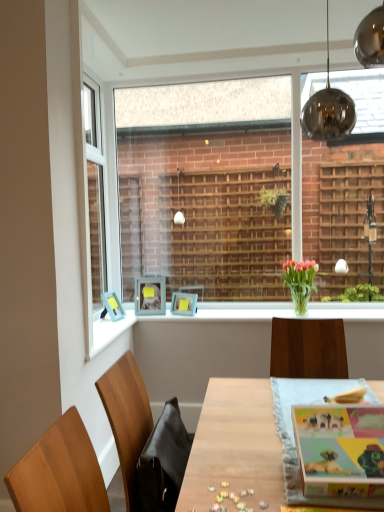
What do you see at coordinates (230, 311) in the screenshot? The width and height of the screenshot is (384, 512). I see `white glossy window sill at center` at bounding box center [230, 311].

Describe the element at coordinates (163, 461) in the screenshot. I see `black leather swivel chair at lower left` at that location.

The image size is (384, 512). In order to click on light blue plastic picture frame at upper left, the second picture frame when ordered from right to left in this screenshot , I will do 150,295.

Image resolution: width=384 pixels, height=512 pixels. Describe the element at coordinates (112, 306) in the screenshot. I see `matte blue picture frame at center, arranged as the 1th picture frame when viewed from the left` at that location.

At what (x,y) coordinates should I click in order to perform the action: click on translucent glass vase at center. Please return your answer as a coordinate pair (x, y). Image resolution: width=384 pixels, height=512 pixels. Looking at the image, I should click on (300, 282).

In terms of height, does clear glass window at center look taller or shorter compared to matte blue picture frame at center, acting as the 3th picture frame starting from the right?

Clearly, clear glass window at center is taller compared to matte blue picture frame at center, acting as the 3th picture frame starting from the right.

Which object is further away from the camera, clear glass window at center or matte blue picture frame at center, acting as the 3th picture frame starting from the right?

clear glass window at center.

Who is smaller, clear glass window at center or matte blue picture frame at center, arranged as the 1th picture frame when viewed from the left?

matte blue picture frame at center, arranged as the 1th picture frame when viewed from the left.

You are a GUI agent. You are given a task and a screenshot of the screen. Output one action in this format:
    pyautogui.click(x=<x>, y=<y>)
    Task: Click on the swivel chair behind the wooden table at center
    
    Given the screenshot: What is the action you would take?
    pyautogui.click(x=163, y=461)

How many degrees apart are the facing directions of wooden table at center and black leather swivel chair at lower left?

The angular difference between wooden table at center and black leather swivel chair at lower left is 90.7 degrees.

From the image's perspective, is wooden table at center located above or below black leather swivel chair at lower left?

wooden table at center is below black leather swivel chair at lower left.

Consider the image. Looking at their sizes, would you say wooden table at center is wider or thinner than black leather swivel chair at lower left?

wooden table at center is wider than black leather swivel chair at lower left.

Does wooden table at center come behind matte blue picture frame at center, arranged as the 1th picture frame when viewed from the left?

No.

Between wooden table at center and matte blue picture frame at center, acting as the 3th picture frame starting from the right, which one has larger width?

With larger width is wooden table at center.

From the wooden table at center, count the 3rd picture frame to the left and point to it. Please provide its 2D coordinates.

[(112, 306)]

Which object is wider, matte blue picture frame at center, acting as the 3th picture frame starting from the right, or wooden table at center?

wooden table at center.

Is matte blue picture frame at center, acting as the 3th picture frame starting from the right, next to wooden table at center and touching it?

matte blue picture frame at center, acting as the 3th picture frame starting from the right, and wooden table at center are clearly separated.

Based on the photo, what's the angular difference between matte blue picture frame at center, acting as the 3th picture frame starting from the right, and wooden table at center's facing directions?

The angular difference between matte blue picture frame at center, acting as the 3th picture frame starting from the right, and wooden table at center is 73.3 degrees.

Based on the photo, measure the distance from matte blue picture frame at center, acting as the 3th picture frame starting from the right, to wooden table at center.

The distance of matte blue picture frame at center, acting as the 3th picture frame starting from the right, from wooden table at center is 4.79 feet.

Considering the relative sizes of black leather swivel chair at lower left and wooden table at center in the image provided, is black leather swivel chair at lower left shorter than wooden table at center?

Yes.

Considering the relative sizes of black leather swivel chair at lower left and wooden table at center in the image provided, is black leather swivel chair at lower left bigger than wooden table at center?

No.

Does point (178, 410) come in front of point (225, 449)?

That is False.

Can you tell me how much wooden table at center and light blue plastic picture frame at upper left, the second picture frame when ordered from right to left, differ in facing direction?

There is a 11.8-degree angle between the facing directions of wooden table at center and light blue plastic picture frame at upper left, the second picture frame when ordered from right to left.

Between wooden table at center and light blue plastic picture frame at upper left, the second picture frame when ordered from right to left, which one is positioned behind?

light blue plastic picture frame at upper left, the second picture frame when ordered from right to left, is more distant.

Is wooden table at center outside of light blue plastic picture frame at upper left, the 2th picture frame viewed from the left?

Absolutely, wooden table at center is external to light blue plastic picture frame at upper left, the 2th picture frame viewed from the left.

Which of these two, wooden table at center or light blue plastic picture frame at upper left, the second picture frame when ordered from right to left, stands taller?

wooden table at center is taller.

Which object is further away from the camera taking this photo, light blue plastic picture frame at upper left, the second picture frame when ordered from right to left, or black leather swivel chair at lower left?

light blue plastic picture frame at upper left, the second picture frame when ordered from right to left, is more distant.

From a real-world perspective, who is located lower, light blue plastic picture frame at upper left, the second picture frame when ordered from right to left, or black leather swivel chair at lower left?

In real-world perspective, black leather swivel chair at lower left is lower.

Is light blue plastic picture frame at upper left, the second picture frame when ordered from right to left, looking in the opposite direction of black leather swivel chair at lower left?

That's not correct — light blue plastic picture frame at upper left, the second picture frame when ordered from right to left, is not looking away from black leather swivel chair at lower left.

Identify the location of the 2nd picture frame below the clear glass window at center (from the image's perspective). The width and height of the screenshot is (384, 512). (112, 306).

Identify the location of swivel chair behind the wooden table at center. This screenshot has width=384, height=512. (163, 461).

Considering their positions, is multicolored paper magazine at center positioned closer to translucent glass vase at center than matte blue picture frame at center, the 3th picture frame when ordered from left to right?

Among the two, matte blue picture frame at center, the 3th picture frame when ordered from left to right, is located nearer to translucent glass vase at center.

From the image, which object appears to be nearer to translucent glass vase at center, multicolored paper magazine at center or matte blue picture frame at center, arranged as the 1th picture frame when viewed from the left?

multicolored paper magazine at center.

Looking at this image, when comparing their distances from wooden table at center, does translucent glass vase at center or light blue plastic picture frame at upper left, the 2th picture frame viewed from the left, seem further?

Among the two, light blue plastic picture frame at upper left, the 2th picture frame viewed from the left, is located further to wooden table at center.

Based on the photo, estimate the real-world distances between objects in this image. Which object is closer to white glossy window sill at center, wooden table at center or clear glass window at center?

Based on the image, clear glass window at center appears to be nearer to white glossy window sill at center.

Based on their spatial positions, is light blue plastic picture frame at upper left, the second picture frame when ordered from right to left, or black leather swivel chair at lower left further from translucent glass vase at center?

black leather swivel chair at lower left is positioned further to the anchor translucent glass vase at center.

Which object lies nearer to the anchor point translucent glass vase at center, clear glass window at center or matte blue picture frame at center, the 3th picture frame when ordered from left to right?

The object closer to translucent glass vase at center is matte blue picture frame at center, the 3th picture frame when ordered from left to right.

Based on their spatial positions, is light blue plastic picture frame at upper left, the second picture frame when ordered from right to left, or wooden table at center closer to matte blue picture frame at center, arranged as the 1th picture frame when viewed from the left?

Among the two, light blue plastic picture frame at upper left, the second picture frame when ordered from right to left, is located nearer to matte blue picture frame at center, arranged as the 1th picture frame when viewed from the left.

Considering their positions, is white glossy window sill at center positioned closer to matte blue picture frame at center, the 3th picture frame when ordered from left to right, than clear glass window at center?

white glossy window sill at center is positioned closer to the anchor matte blue picture frame at center, the 3th picture frame when ordered from left to right.

The image size is (384, 512). What are the coordinates of `table situated between black leather swivel chair at lower left and multicolored paper magazine at center from left to right` in the screenshot? It's located at (235, 446).

Locate an element on the screen. houseplant between wooden table at center and light blue plastic picture frame at upper left, the 2th picture frame viewed from the left, from front to back is located at coordinates (300, 282).

Locate an element on the screen. The width and height of the screenshot is (384, 512). magazine between wooden table at center and matte blue picture frame at center, acting as the 3th picture frame starting from the right, in the front-back direction is located at coordinates (340, 450).

Identify the location of houseplant between black leather swivel chair at lower left and white glossy window sill at center from front to back. The width and height of the screenshot is (384, 512). (300, 282).